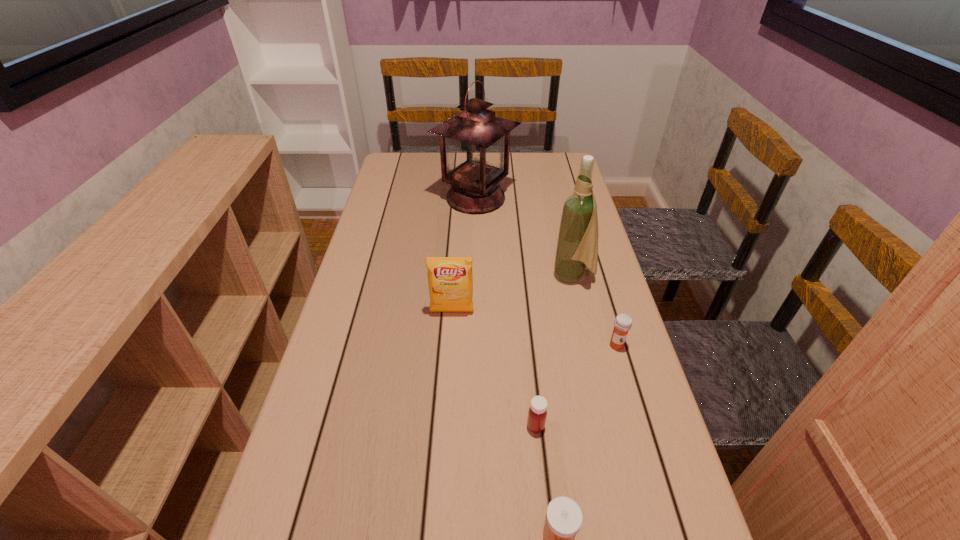
Locate which object ranks in proximity to the fourth farthest object. Please provide its 2D coordinates. Your answer should be formatted as a tuple, i.e. [(x, y)], where the tuple contains the x and y coordinates of a point satisfying the conditions above.

[(577, 246)]

Where is `object that is the fourth closest to the second farthest object`? The height and width of the screenshot is (540, 960). object that is the fourth closest to the second farthest object is located at coordinates (537, 413).

This screenshot has height=540, width=960. Identify the location of medicine that is the second closest to the rightmost medicine. (564, 517).

Identify the location of medicine that stands as the second closest to the oil lamp. This screenshot has width=960, height=540. (537, 413).

Find the location of `vacant area in the image that satisfies the following two spatial constraints: 1. on the front-facing side of the wine bottle; 2. on the front of the third tallest object with the logo`. vacant area in the image that satisfies the following two spatial constraints: 1. on the front-facing side of the wine bottle; 2. on the front of the third tallest object with the logo is located at coordinates (582, 312).